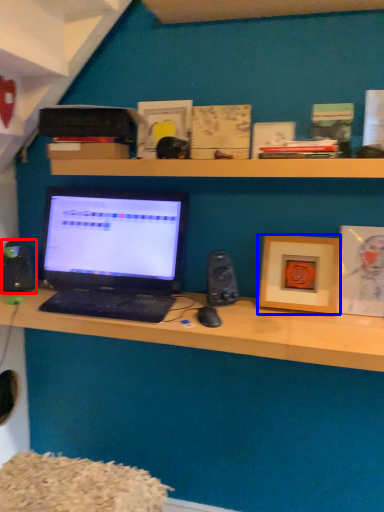
Question: Which object appears farthest to the camera in this image, speaker (highlighted by a red box) or picture frame (highlighted by a blue box)?

Choices:
 (A) speaker
 (B) picture frame

Answer: (A)